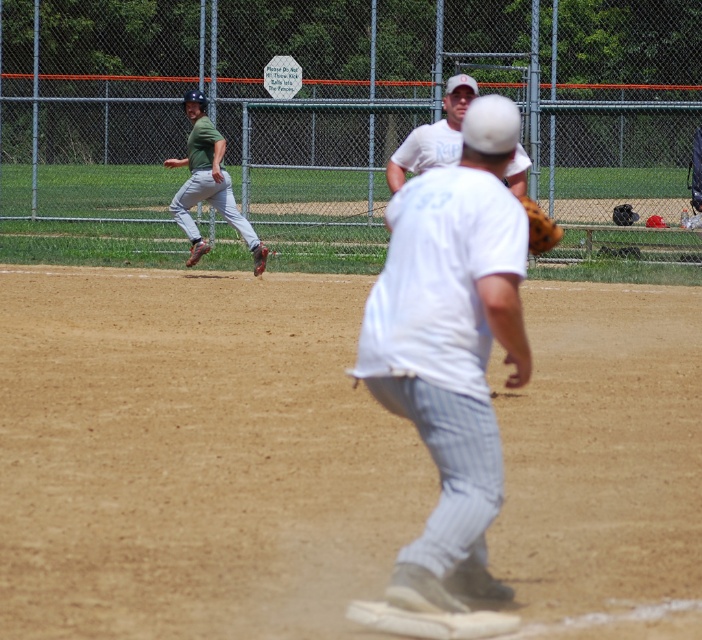
You are a photographer standing at the baseline of the baseball field. You want to take a photo that includes both points marked as point (204, 168) and point (538, 234). Which point should you focus on first to ensure both are in clear focus?

You should focus on point (204, 168) first because it is closer to the camera than point (538, 234). This way, the depth of field will cover both points effectively.

You are a spectator at the baseball game and want to take a photo of both the green fabric baseball uniform at upper left and the white cotton shirt at upper center. Which one should you focus on first to ensure both are in focus?

You should focus on the green fabric baseball uniform at upper left first because it is closer to you than the white cotton shirt at upper center, so adjusting focus from near to far will help both be in focus.